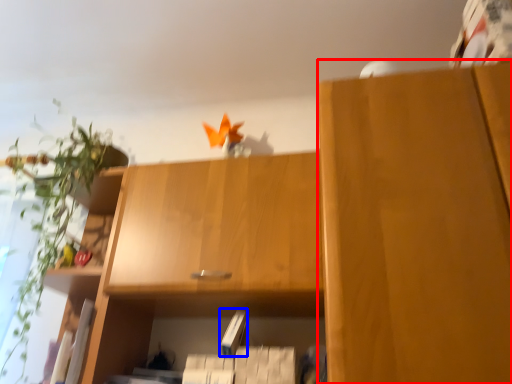
Question: Among these objects, which one is farthest to the camera, cabinetry (highlighted by a red box) or paperback book (highlighted by a blue box)?

Choices:
 (A) cabinetry
 (B) paperback book

Answer: (B)